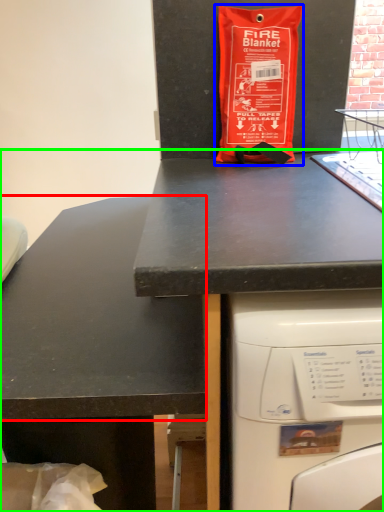
Question: Which is nearer to the counter top (highlighted by a red box)? bag (highlighted by a blue box) or desk (highlighted by a green box).

Choices:
 (A) bag
 (B) desk

Answer: (B)